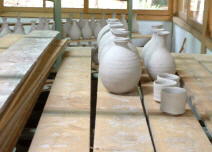
The width and height of the screenshot is (212, 152). Identify the location of large vases. (125, 63), (106, 44), (105, 39), (105, 36), (103, 30).